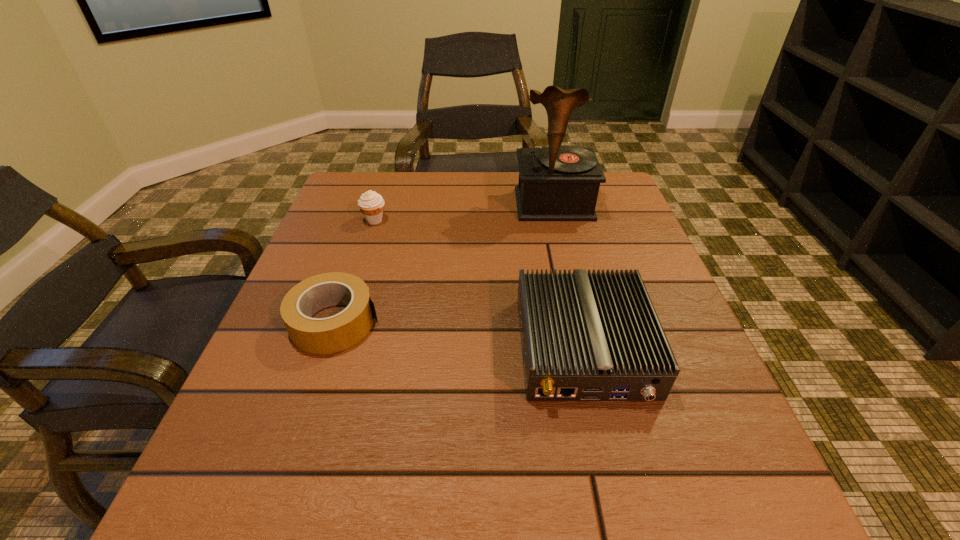
Locate an element on the screen. vacant area at the far left corner of the desktop is located at coordinates (353, 184).

At what (x,y) coordinates should I click in order to perform the action: click on vacant space at the far right corner of the desktop. Please return your answer as a coordinate pair (x, y). This screenshot has width=960, height=540. Looking at the image, I should click on (612, 177).

Locate an element on the screen. This screenshot has width=960, height=540. vacant point located between the phonograph_record and the muffin is located at coordinates (464, 212).

At what (x,y) coordinates should I click in order to perform the action: click on unoccupied area between the shortest object and the router. Please return your answer as a coordinate pair (x, y). Image resolution: width=960 pixels, height=540 pixels. Looking at the image, I should click on (460, 335).

Identify the location of vacant space that's between the phonograph_record and the muffin. (464, 212).

Image resolution: width=960 pixels, height=540 pixels. I want to click on free space between the tallest object and the shortest object, so click(444, 264).

Find the location of a particular element. The width and height of the screenshot is (960, 540). blank region between the shortest object and the phonograph_record is located at coordinates (444, 264).

Identify the location of free space between the router and the shortest object. (460, 335).

What are the coordinates of `unoccupied area between the duct tape and the muffin` in the screenshot? It's located at (355, 272).

The height and width of the screenshot is (540, 960). In order to click on unoccupied position between the router and the muffin in this screenshot , I will do `click(479, 284)`.